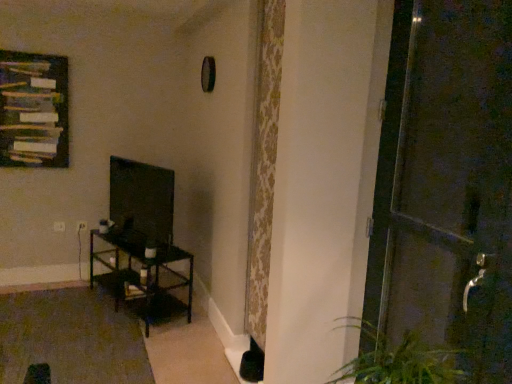
I want to click on empty space that is ontop of wooden frame at upper left (from a real-world perspective), so click(x=27, y=51).